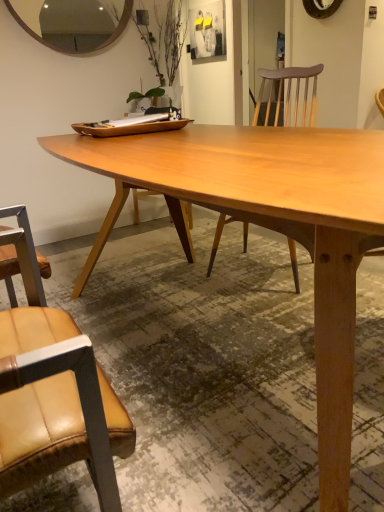
Question: From a real-world perspective, is light brown wood table at center positioned above or below leather at left?

Choices:
 (A) above
 (B) below

Answer: (B)

Question: Is light brown wood table at center to the left or to the right of leather at left in the image?

Choices:
 (A) left
 (B) right

Answer: (B)

Question: Estimate the real-world distances between objects in this image. Which object is farther from the light brown wood table at center?

Choices:
 (A) leather at left
 (B) wooden mirror at upper left

Answer: (B)

Question: Considering the real-world distances, which object is closest to the wooden mirror at upper left?

Choices:
 (A) light brown wood table at center
 (B) leather at left

Answer: (A)